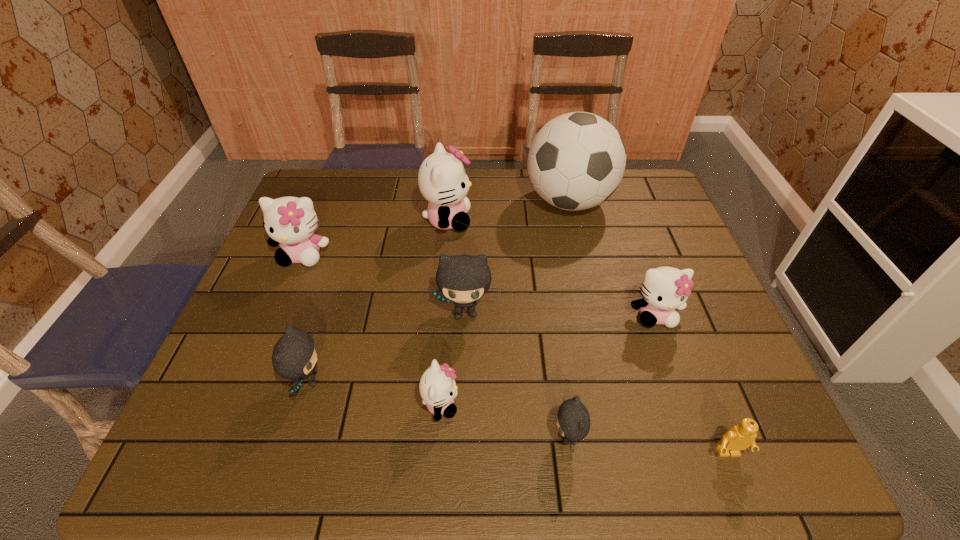
The image size is (960, 540). Identify the location of blank space located on the front-facing side of the smallest white kitten. [x=540, y=404].

Locate an element on the screen. free location located on the front-facing side of the rightmost gray kitten is located at coordinates (356, 437).

Find the location of a particular element. The width and height of the screenshot is (960, 540). vacant space located on the front-facing side of the rightmost gray kitten is located at coordinates (442, 437).

The image size is (960, 540). I want to click on free region located 0.200m on the front-facing side of the rightmost gray kitten, so click(452, 437).

Where is `soccer ball that is positioned at the far edge`? soccer ball that is positioned at the far edge is located at coordinates (576, 161).

What are the coordinates of `kitten situated at the far edge` in the screenshot? It's located at (442, 179).

You are a GUI agent. You are given a task and a screenshot of the screen. Output one action in this format:
    pyautogui.click(x=<x>, y=<y>)
    Task: Click on the Lego at the near edge
    
    Given the screenshot: What is the action you would take?
    pyautogui.click(x=740, y=437)

Find the location of `object at the left edge`. object at the left edge is located at coordinates (290, 222).

Find the location of a particular element. Image resolution: width=960 pixels, height=540 pixels. kitten that is positioned at the right edge is located at coordinates (664, 289).

Locate an element on the screen. The width and height of the screenshot is (960, 540). Lego present at the right edge is located at coordinates click(x=740, y=437).